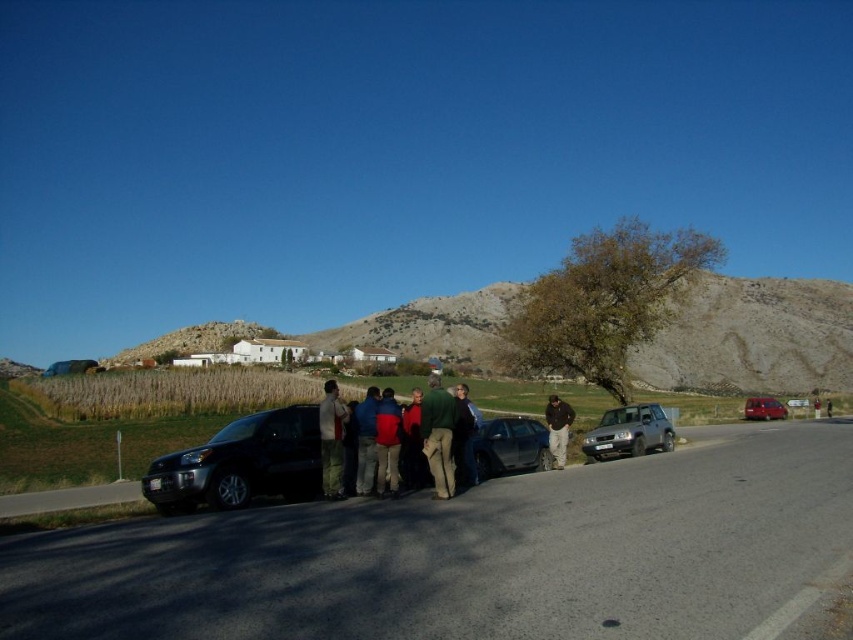
You are standing at the origin point of the coordinate system in this rural scene. There is a metallic blue sedan at center. Can you determine its exact location using the coordinate system provided?

The metallic blue sedan at center is located at point (x=509, y=445) in the coordinate system.

You are a photographer standing at the edge of the paved road near the two parked SUVs. You notice two people wearing dark green fabric jacket at center and green wool sweater at center. Which clothing item would appear bigger in your camera view?

The dark green fabric jacket at center appears bigger in the camera view because it is larger in size than the green wool sweater at center.

You are a photographer trying to capture a group photo of the people at the scene. You need to ensure that both the dark green fabric jacket at center and the green wool sweater at center are in focus. Given that your camera has a depth of field that can cover 20 inches, will both items be in focus?

The dark green fabric jacket at center and the green wool sweater at center are 21.00 inches apart from each other. Since the camera can only cover 20 inches, they are just slightly out of the depth of field range. Therefore, both items cannot be in focus simultaneously.